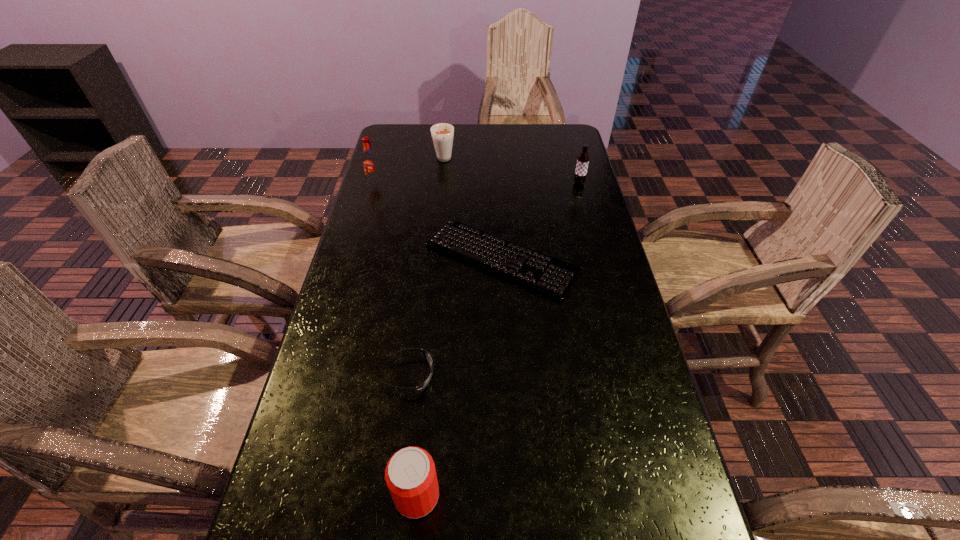
This screenshot has height=540, width=960. I want to click on the leftmost object, so click(370, 163).

The height and width of the screenshot is (540, 960). Identify the location of the second root beer from left to right. (442, 134).

Locate an element on the screen. the farthest object is located at coordinates pyautogui.click(x=442, y=134).

Where is `the rightmost root beer`? This screenshot has width=960, height=540. the rightmost root beer is located at coordinates (583, 159).

The image size is (960, 540). I want to click on beer can, so click(x=410, y=474).

Find the location of a particular element. the fifth tallest object is located at coordinates (427, 356).

Identify the location of the fifth farthest object. (427, 356).

Image resolution: width=960 pixels, height=540 pixels. In order to click on computer keyboard in this screenshot , I will do `click(554, 278)`.

Locate an element on the screen. The image size is (960, 540). the shortest object is located at coordinates (554, 278).

This screenshot has width=960, height=540. What are the coordinates of `free spot located on the right of the leftmost object` in the screenshot? It's located at (485, 184).